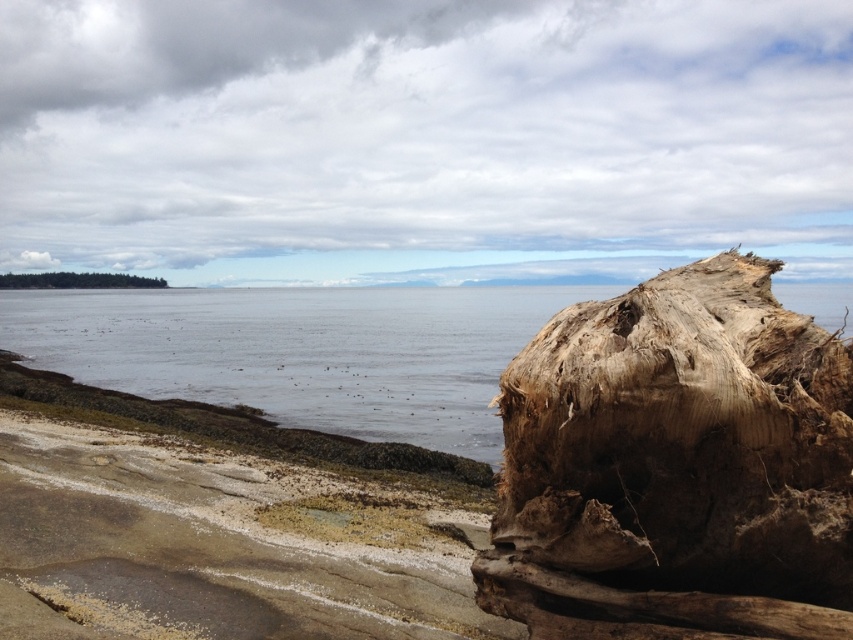
You are a beachcomber searching for driftwood. You spot a driftwood log at right and a brown rough log at left. Which one is shorter?

The driftwood log at right is shorter than the brown rough log at left.

You are standing on the beach and want to take a photo of the clear water at center and the brown rough log at left. Which object should you focus on first if you want both to be in sharp focus?

The clear water at center is in front of the brown rough log at left, so you should focus on the brown rough log at left first to ensure both are in sharp focus.